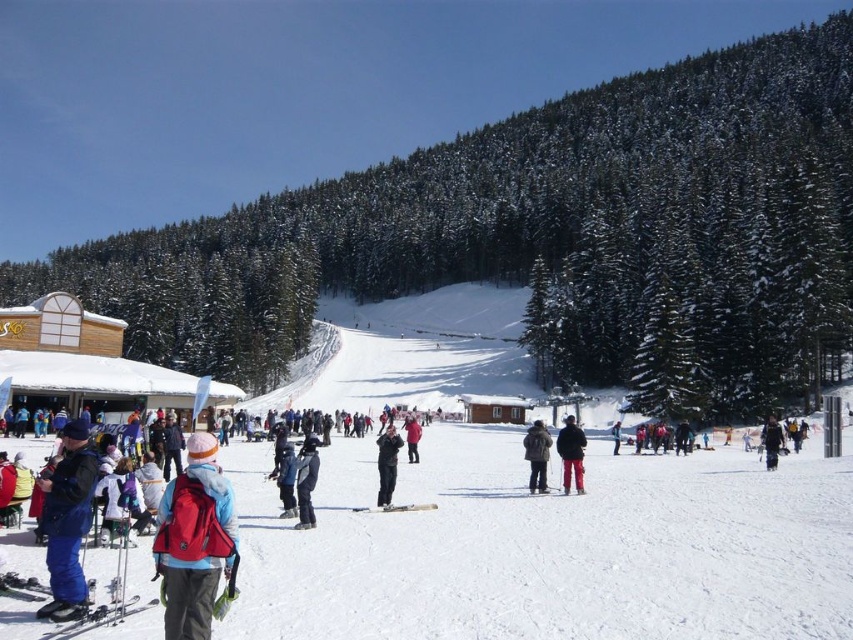
Question: Does metallic skis at lower left have a lesser width compared to black matte jacket at center?

Choices:
 (A) yes
 (B) no

Answer: (A)

Question: Which object is positioned closest to the green textured pine trees at center?

Choices:
 (A) matte black jacket at center
 (B) white matte ski at center
 (C) dark gray jacket at center
 (D) metallic skis at lower left

Answer: (C)

Question: Can you confirm if red pants at center is positioned to the left of metallic skis at lower left?

Choices:
 (A) yes
 (B) no

Answer: (B)

Question: Considering the real-world distances, which object is closest to the matte blue ski at lower left?

Choices:
 (A) red pants at center
 (B) white matte ski at center

Answer: (B)

Question: Which of the following is the closest to the observer?

Choices:
 (A) black matte snowboarder at lower right
 (B) green textured pine trees at center

Answer: (A)

Question: Does matte blue ski at lower left appear under black matte snowboarder at lower right?

Choices:
 (A) yes
 (B) no

Answer: (B)